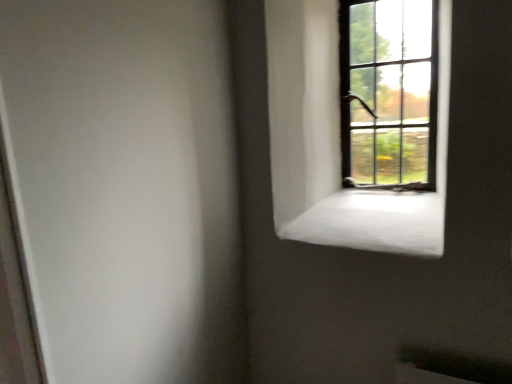
Question: Is point (345, 163) positioned closer to the camera than point (352, 221)?

Choices:
 (A) closer
 (B) farther

Answer: (B)

Question: In terms of size, does dark brown wooden window at upper right appear bigger or smaller than white concrete window sill at upper right?

Choices:
 (A) small
 (B) big

Answer: (A)

Question: In terms of width, does dark brown wooden window at upper right look wider or thinner when compared to white concrete window sill at upper right?

Choices:
 (A) wide
 (B) thin

Answer: (B)

Question: From a real-world perspective, relative to dark brown wooden window at upper right, is white concrete window sill at upper right vertically above or below?

Choices:
 (A) below
 (B) above

Answer: (A)

Question: From the image's perspective, is white concrete window sill at upper right located above or below dark brown wooden window at upper right?

Choices:
 (A) above
 (B) below

Answer: (B)

Question: Is white concrete window sill at upper right bigger or smaller than dark brown wooden window at upper right?

Choices:
 (A) small
 (B) big

Answer: (B)

Question: Does point (421, 218) appear closer or farther from the camera than point (411, 142)?

Choices:
 (A) farther
 (B) closer

Answer: (B)